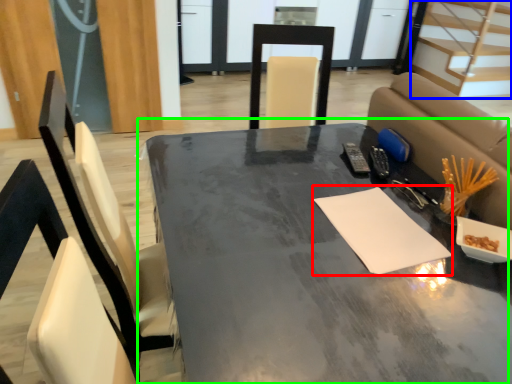
Question: Estimate the real-world distances between objects in this image. Which object is farther from notepad (highlighted by a red box), stairwell (highlighted by a blue box) or table (highlighted by a green box)?

Choices:
 (A) stairwell
 (B) table

Answer: (A)